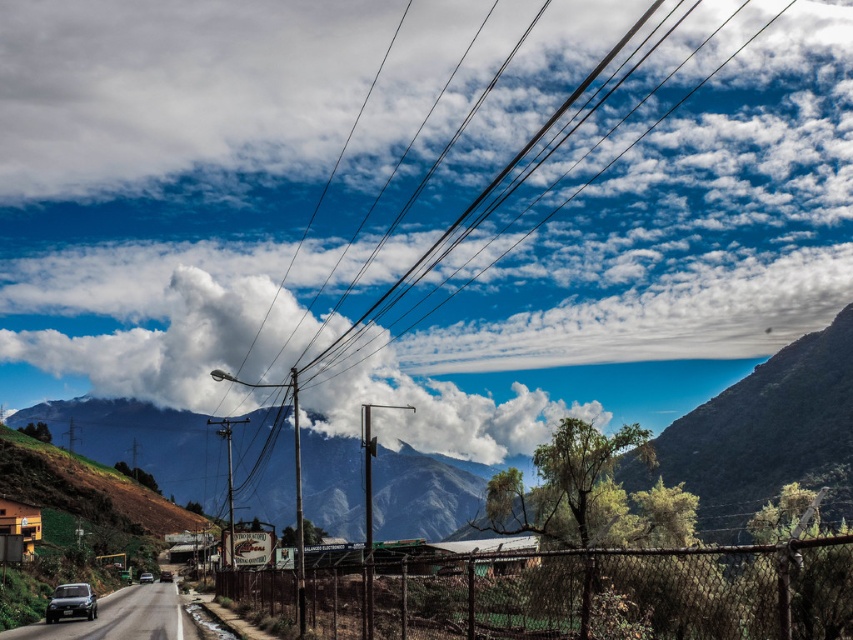
You are a delivery driver who needs to park your truck, which is 2.5 meters wide, on the road. You see the shiny black car at lower left and the metallic silver car at center. Which parking spot between these two cars can accommodate your truck?

The metallic silver car at center has a greater width than the shiny black car at lower left. Since your truck is 2.5 meters wide, the parking spot between the metallic silver car at center and the shiny black car at lower left can accommodate your truck if the space between them is sufficient. However, the exact width of the parking spot isnanot provided, so you should measure the space before deciding.

You are driving a car and see the metallic silver car at center ahead on the road. There is a white fluffy cloud at upper center in the sky. From your perspective, which object is positioned to the right of the other?

The white fluffy cloud at upper center is to the right of the metallic silver car at center.

You are a photographer planning to capture a landscape photo that includes both the rugged stone mountain at center and the shiny black car at lower left. Considering their sizes, which object should you focus on to ensure both are in frame without needing to zoom in or out excessively?

The rugged stone mountain at center is taller than the shiny black car at lower left, so focusing on the mountain will help keep both in frame without adjusting the zoom significantly.